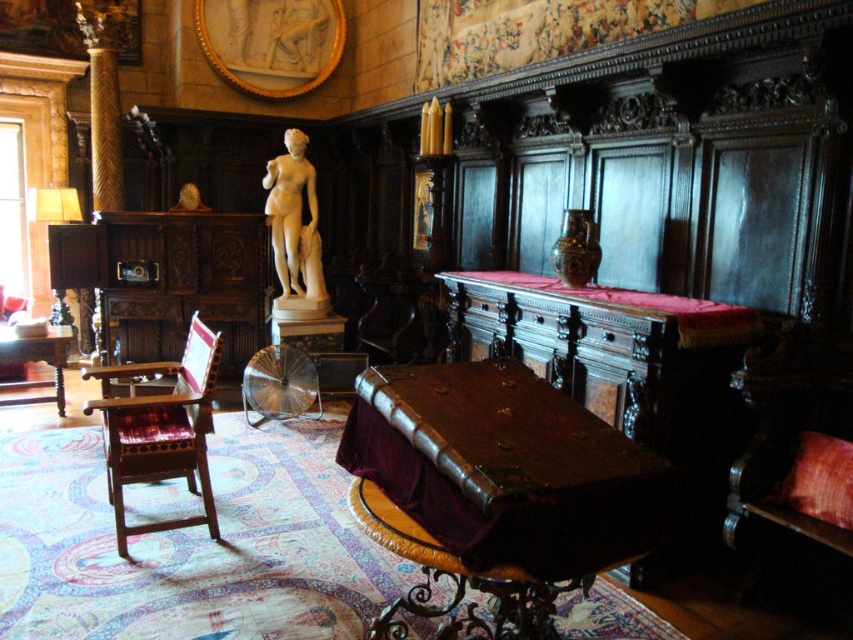
Question: Which of the following is the closest to the observer?

Choices:
 (A) (299, 173)
 (B) (804, 412)

Answer: (B)

Question: Can you confirm if white marble statue at center is smaller than wooden table at left?

Choices:
 (A) no
 (B) yes

Answer: (B)

Question: Among these points, which one is farthest from the camera?

Choices:
 (A) (575, 496)
 (B) (280, 216)

Answer: (B)

Question: Is the position of wooden woven armchair at left less distant than that of white marble statue at center?

Choices:
 (A) yes
 (B) no

Answer: (A)

Question: Considering the real-world distances, which object is farthest from the wooden woven armchair at left?

Choices:
 (A) wooden table at left
 (B) white marble statue at center

Answer: (B)

Question: Is the position of leather-bound trunk at center more distant than that of wooden table at left?

Choices:
 (A) no
 (B) yes

Answer: (A)